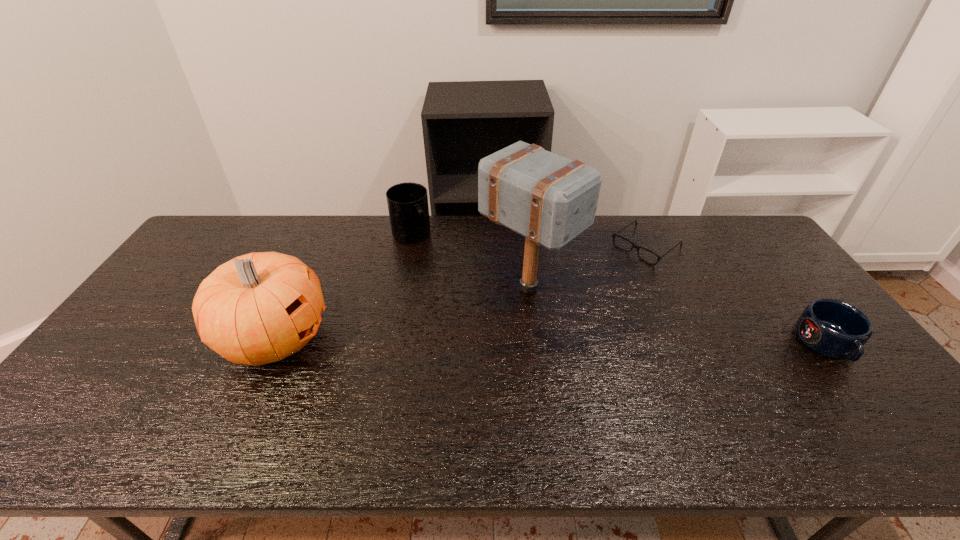
Find the location of a particular element. The image size is (960, 540). free space between the fourth shortest object and the rightmost object is located at coordinates (551, 341).

The height and width of the screenshot is (540, 960). What are the coordinates of `empty location between the pumpkin and the spectacles` in the screenshot? It's located at (461, 292).

Image resolution: width=960 pixels, height=540 pixels. What are the coordinates of `empty space between the nearer mug and the mallet` in the screenshot? It's located at (678, 316).

Where is `vacant point located between the mallet and the fourth object from left to right`? This screenshot has width=960, height=540. vacant point located between the mallet and the fourth object from left to right is located at coordinates (587, 267).

This screenshot has height=540, width=960. In order to click on free space between the shorter mug and the pumpkin in this screenshot , I will do `click(551, 341)`.

Where is `free area in between the tallest object and the nearer mug`? The image size is (960, 540). free area in between the tallest object and the nearer mug is located at coordinates (678, 316).

You are a GUI agent. You are given a task and a screenshot of the screen. Output one action in this format:
    pyautogui.click(x=<x>, y=<y>)
    Task: Click on the vacant area between the tallest object and the second tallest object
    This screenshot has height=540, width=960.
    Given the screenshot: What is the action you would take?
    pyautogui.click(x=401, y=313)

Find the location of `object that stands as the closest to the right mug`. object that stands as the closest to the right mug is located at coordinates (614, 235).

The width and height of the screenshot is (960, 540). Identify the location of object that is the fourth closest one to the second tallest object. (832, 328).

Identify the location of vacant space that satisfies the following two spatial constraints: 1. on the front side of the shortest object; 2. on the right side of the taller mug. The height and width of the screenshot is (540, 960). (409, 246).